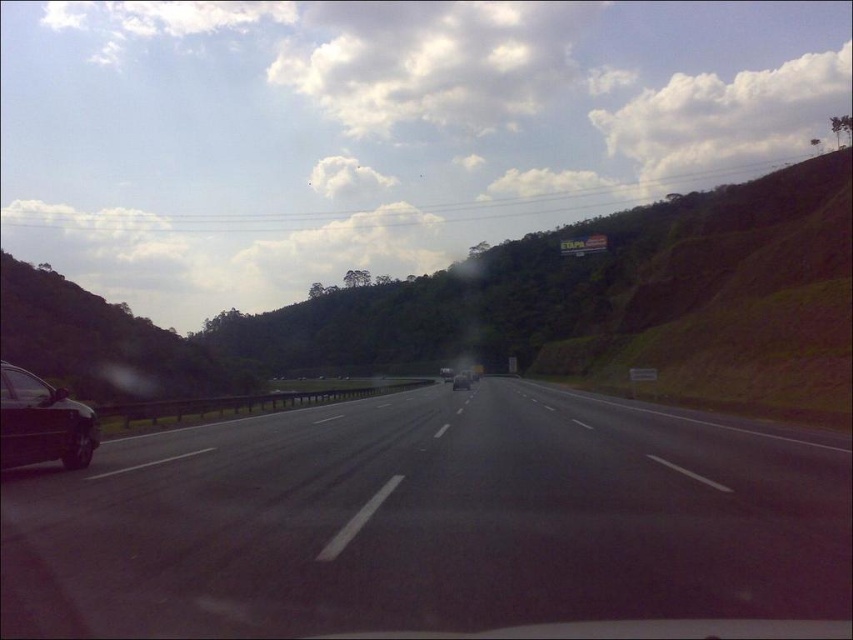
You are driving a metallic silver sedan at center and want to know if you can safely change lanes to the right without crossing the solid white line. Based on the scene, can you determine if there is enough space between the black asphalt highway at center and the edge marked by the solid white line for your vehicle?

The black asphalt highway at center is wider than the metallic silver sedan at center. Since the highway is wider than the sedan, there should be sufficient space to change lanes to the right without crossing the solid white line, provided you stay within the lane markings.

You are a passenger in a car and looking out the window. You notice a shiny black sedan at left and a metallic silver car at center. Which car is shorter in height?

The shiny black sedan at left is not as tall as the metallic silver car at center, so the shiny black sedan at left is shorter in height.

You are driving a car with a trunk length of 1.8 meters. You want to park your car perpendicular to the black asphalt highway at center so that the entire trunk is off the road. Is this possible?

The distance between the black asphalt highway at center and the camera is 4.47 meters. Since the trunk is only 1.8 meters long, parking perpendicular would require at least 1.8 meters of space off the road. Since 4.47 meters is more than enough, yes, the trunk can be entirely off the road when parked perpendicular.